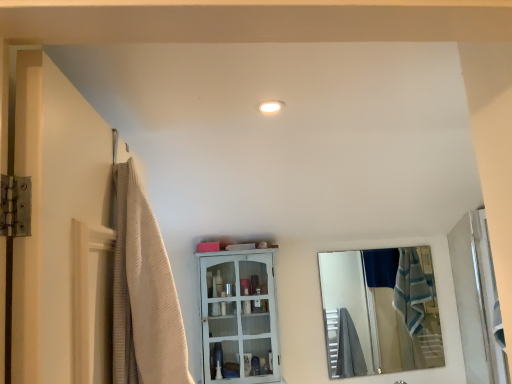
Question: In terms of height, does white painted wood cabinet at center look taller or shorter compared to beige textured shower curtain at left?

Choices:
 (A) short
 (B) tall

Answer: (B)

Question: From the image's perspective, is white painted wood cabinet at center positioned above or below beige textured shower curtain at left?

Choices:
 (A) below
 (B) above

Answer: (A)

Question: Considering the real-world distances, which object is farthest from the white glossy light fixture at upper center?

Choices:
 (A) white glossy door at right
 (B) white painted wood cabinet at center
 (C) beige textured shower curtain at left
 (D) silver reflective mirror at right

Answer: (D)

Question: Which is farther from the beige textured shower curtain at left?

Choices:
 (A) silver reflective mirror at right
 (B) white glossy light fixture at upper center
 (C) white painted wood cabinet at center
 (D) white glossy door at right

Answer: (A)